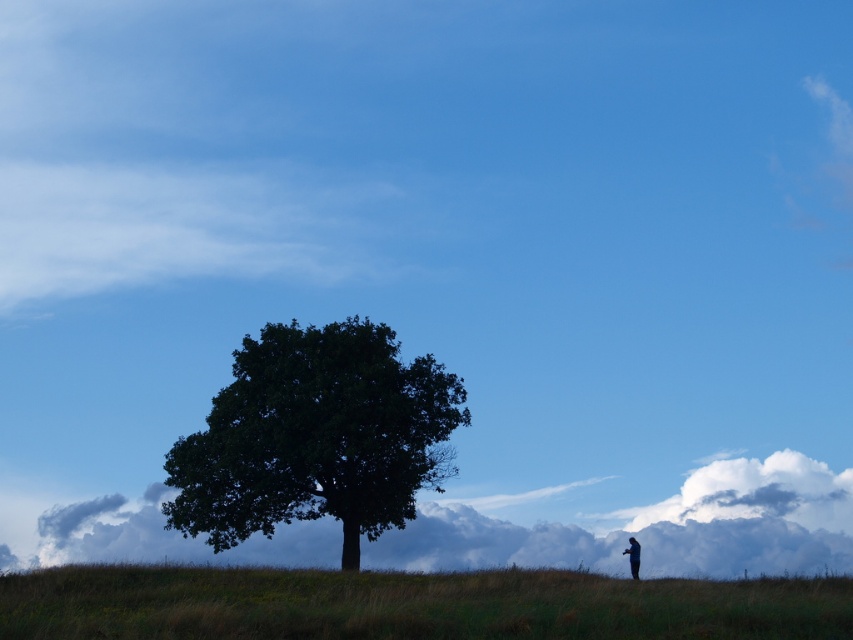
Question: Which is nearer to the green grassy hillside at lower center?

Choices:
 (A) green leafy tree at center
 (B) blue fabric person at lower right

Answer: (B)

Question: Which point appears farthest from the camera in this image?

Choices:
 (A) (265, 630)
 (B) (633, 552)
 (C) (294, 504)

Answer: (C)

Question: Which object is farther from the camera taking this photo?

Choices:
 (A) green grassy hillside at lower center
 (B) green leafy tree at center
 (C) blue fabric person at lower right

Answer: (B)

Question: In this image, where is green leafy tree at center located relative to blue fabric person at lower right?

Choices:
 (A) below
 (B) above

Answer: (B)

Question: Is green grassy hillside at lower center thinner than green leafy tree at center?

Choices:
 (A) no
 (B) yes

Answer: (A)

Question: Can you confirm if green grassy hillside at lower center is smaller than green leafy tree at center?

Choices:
 (A) no
 (B) yes

Answer: (A)